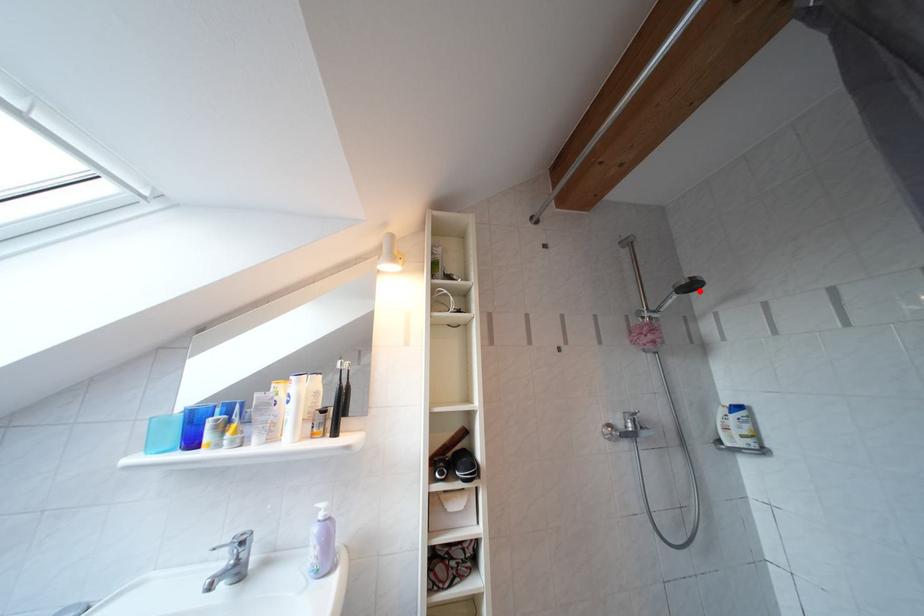
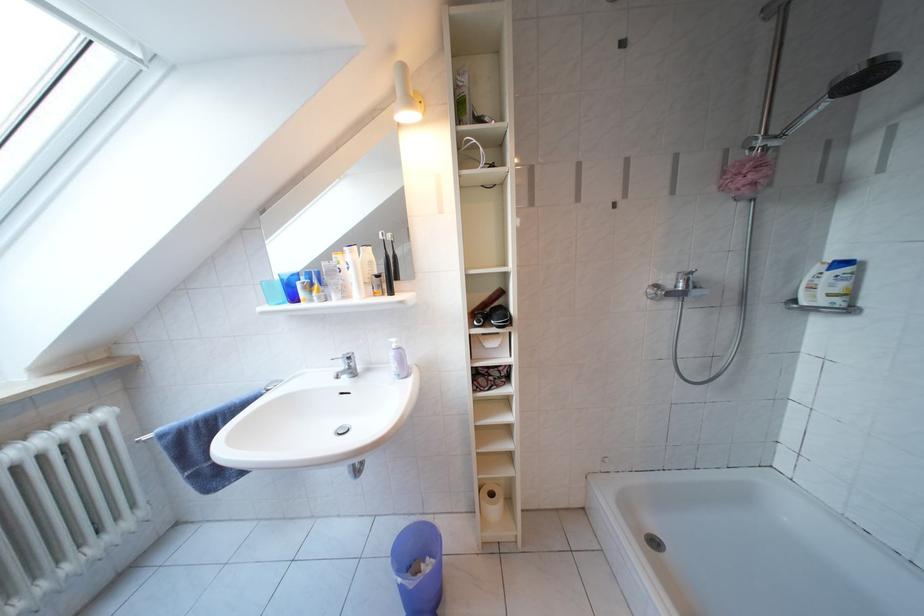
Locate, in the second image, the point that corresponds to the highlighted location in the first image.

(876, 82)